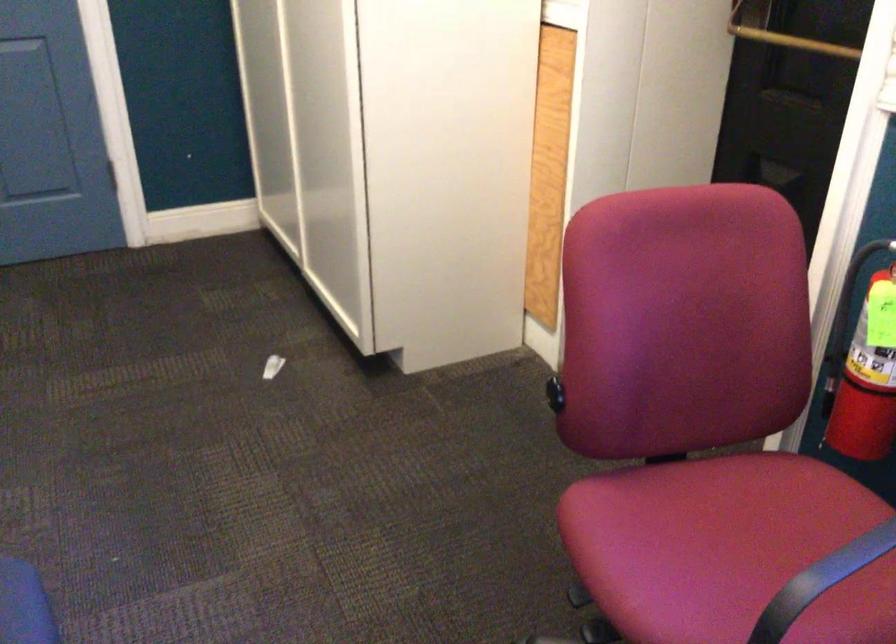
At what (x,y) coordinates should I click in order to perform the action: click on white paper scrap. Please return your answer as a coordinate pair (x, y). The width and height of the screenshot is (896, 644). Looking at the image, I should click on (271, 366).